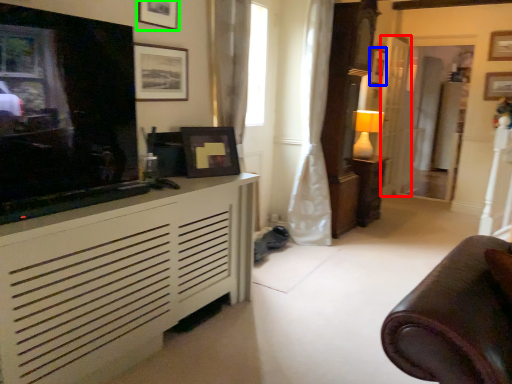
Question: Which is nearer to the door (highlighted by a red box)? picture frame (highlighted by a blue box) or picture frame (highlighted by a green box).

Choices:
 (A) picture frame
 (B) picture frame

Answer: (A)